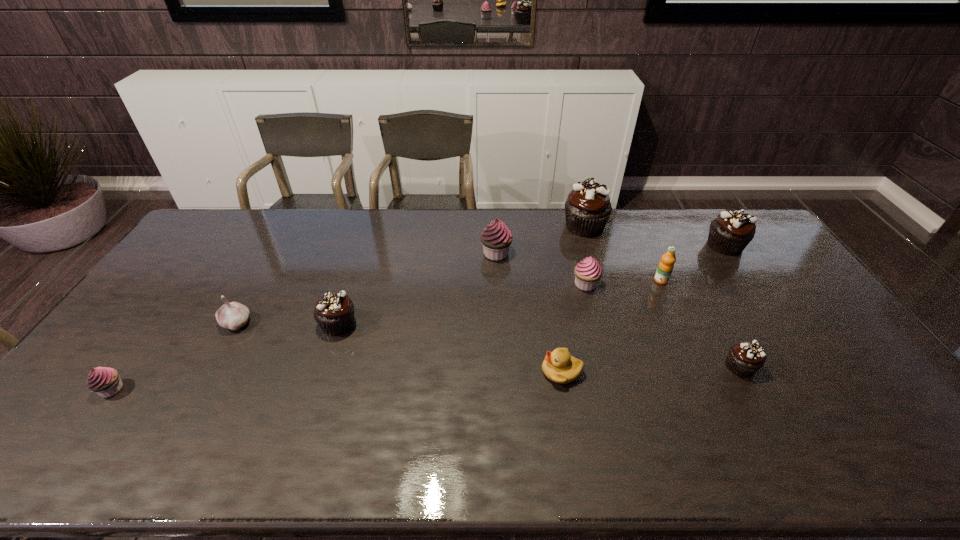
This screenshot has height=540, width=960. What are the coordinates of `the second farthest pink cupcake` in the screenshot? It's located at (588, 271).

Locate an element on the screen. Image resolution: width=960 pixels, height=540 pixels. white garlic is located at coordinates (233, 315).

Where is `garlic`? The width and height of the screenshot is (960, 540). garlic is located at coordinates (233, 315).

This screenshot has height=540, width=960. Find the location of `the second object from right to left`. the second object from right to left is located at coordinates (743, 359).

Image resolution: width=960 pixels, height=540 pixels. Find the location of `the second cupcake from right to left`. the second cupcake from right to left is located at coordinates (743, 359).

Identify the location of the leftmost pink cupcake. (105, 381).

The height and width of the screenshot is (540, 960). What are the coordinates of `the nearest pink cupcake` in the screenshot? It's located at pyautogui.click(x=105, y=381).

At what (x,y) coordinates should I click in order to perform the action: click on the fifth object from left to right. Please return your answer as a coordinate pair (x, y). The height and width of the screenshot is (540, 960). Looking at the image, I should click on (559, 366).

Locate an element on the screen. The height and width of the screenshot is (540, 960). duckling is located at coordinates (559, 366).

At what (x,y) coordinates should I click in order to perform the action: click on free spot located on the left of the tallest cupcake. Please return your answer as a coordinate pair (x, y). The height and width of the screenshot is (540, 960). Looking at the image, I should click on (491, 226).